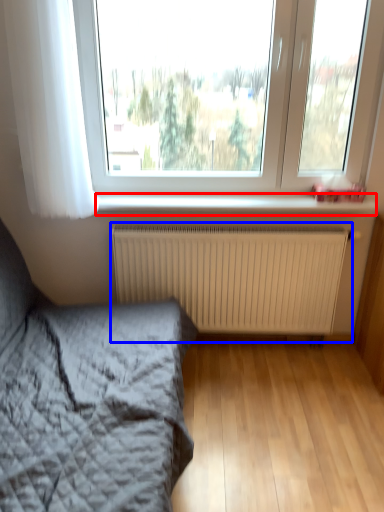
Question: Which object appears farthest to the camera in this image, window sill (highlighted by a red box) or radiator (highlighted by a blue box)?

Choices:
 (A) window sill
 (B) radiator

Answer: (B)